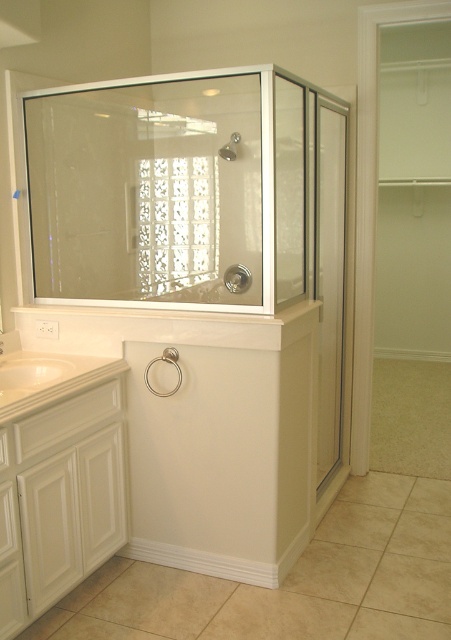
You are standing in the bathroom and want to enter the walk in shower. The clear glass screen door at right is the entrance. Where should you walk to in order to enter the shower?

You should walk towards the clear glass screen door at right to enter the shower since it is the entrance located at point [330,276].

You are a delivery person who needs to place a 40 inch wide package between the clear glass screen door at right and the clear glass shower at center. Can the package fit in the space between them?

The distance between the clear glass screen door at right and the clear glass shower at center is 38.44 inches, which is less than the 40 inch width of the package. Therefore, the package cannot fit in the space between them.

You are a plumber who needs to replace a pipe connecting the clear glass shower at center and the white glossy faucet at upper left. The replacement pipe you have is 1.5 meters long. Will this pipe be sufficient to connect them?

The clear glass shower at center and the white glossy faucet at upper left are 1.74 meters apart from each other. The replacement pipe is only 1.5 meters long, which is shorter than the required distance. Therefore, the pipe will not be sufficient to connect them.